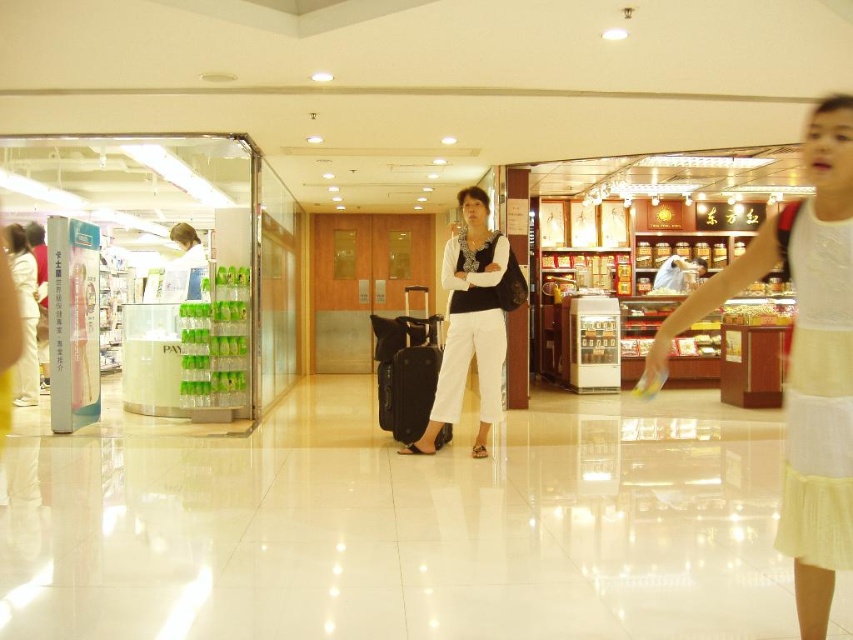
Question: Does white cotton dress at center appear over white matte pants at center?

Choices:
 (A) no
 (B) yes

Answer: (A)

Question: Which object is farther from the camera taking this photo?

Choices:
 (A) black matte suitcase at center
 (B) white matte pants at center
 (C) white cotton dress at center

Answer: (A)

Question: Which object appears farthest from the camera in this image?

Choices:
 (A) black matte suitcase at center
 (B) white matte pants at center

Answer: (A)

Question: Is white matte pants at center to the right of black matte suitcase at center from the viewer's perspective?

Choices:
 (A) yes
 (B) no

Answer: (A)

Question: Is white cotton dress at center wider than black matte suitcase at center?

Choices:
 (A) no
 (B) yes

Answer: (B)

Question: Which point appears closest to the camera in this image?

Choices:
 (A) (817, 291)
 (B) (498, 353)

Answer: (A)